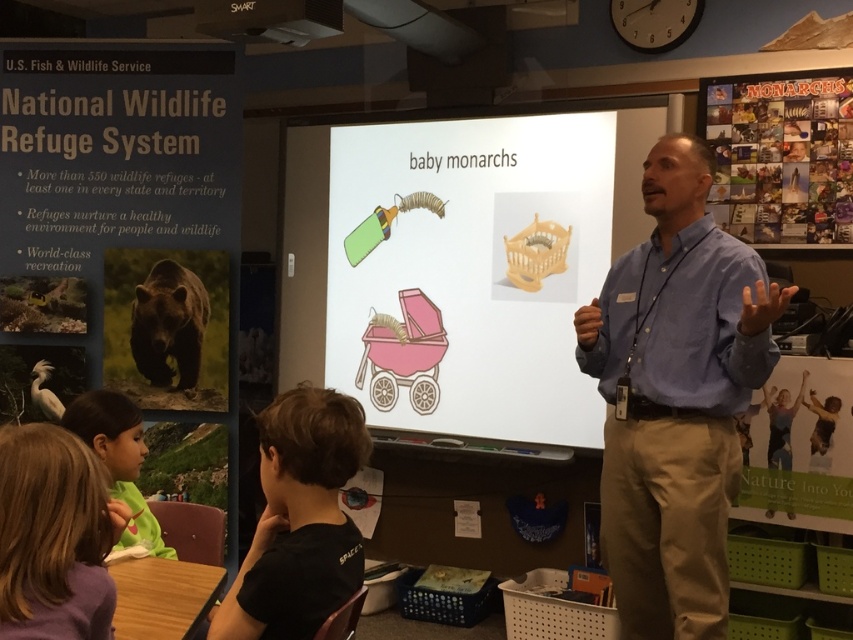
Question: Is matte plastic stroller at center further to camera compared to smooth brown hair at lower left?

Choices:
 (A) no
 (B) yes

Answer: (B)

Question: Where is matte plastic stroller at center located in relation to black plastic projector at upper center in the image?

Choices:
 (A) right
 (B) left

Answer: (A)

Question: Among these objects, which one is farthest from the camera?

Choices:
 (A) black cotton shirt at lower left
 (B) light brown hair at lower left
 (C) pink paper baby carriage at center

Answer: (C)

Question: Is blue shirt at center below black cotton shirt at lower left?

Choices:
 (A) no
 (B) yes

Answer: (A)

Question: Which point is closer to the camera?

Choices:
 (A) (386, 321)
 (B) (219, 22)

Answer: (B)

Question: Which is farther from the matte plastic stroller at center?

Choices:
 (A) smooth brown hair at lower left
 (B) pink paper baby carriage at center
 (C) light brown hair at lower left

Answer: (A)